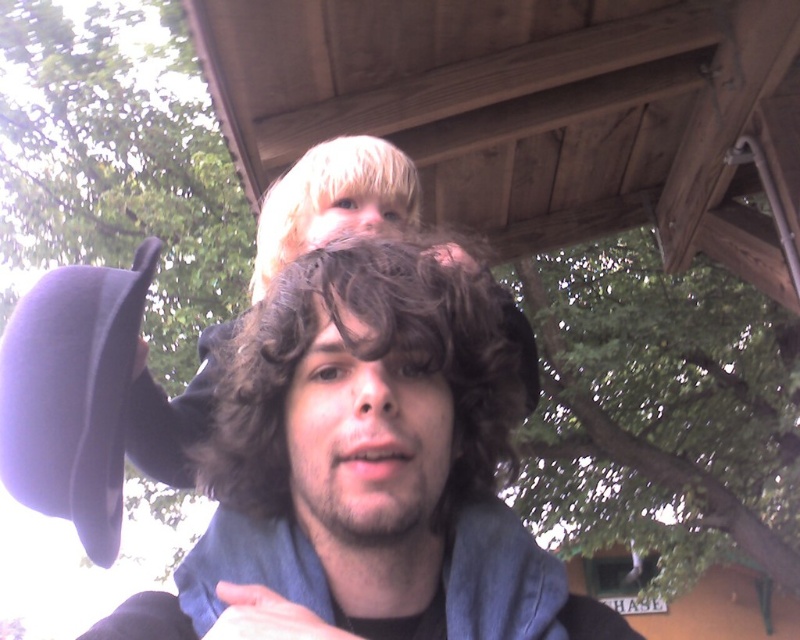
In the scene shown: Is matte purple hat at left positioned at the back of blondehair texture at upper center?

No, matte purple hat at left is in front of blondehair texture at upper center.

From the picture: Does matte purple hat at left appear over blondehair texture at upper center?

Actually, matte purple hat at left is below blondehair texture at upper center.

Who is more distant from viewer, (x=38, y=436) or (x=360, y=209)?

The point (x=360, y=209) is behind.

Where is `matte purple hat at left`? The width and height of the screenshot is (800, 640). matte purple hat at left is located at coordinates (72, 394).

How much distance is there between curly brown hair at center and matte purple hat at left?

curly brown hair at center is 9.54 inches away from matte purple hat at left.

The image size is (800, 640). I want to click on curly brown hair at center, so click(372, 360).

At what (x,y) coordinates should I click in order to perform the action: click on curly brown hair at center. Please return your answer as a coordinate pair (x, y). The width and height of the screenshot is (800, 640). Looking at the image, I should click on (372, 360).

Who is higher up, curly brown hair at center or blondehair texture at upper center?

blondehair texture at upper center is higher up.

Which is in front, point (264, 436) or point (396, 220)?

Point (264, 436)

Locate an element on the screen. Image resolution: width=800 pixels, height=640 pixels. curly brown hair at center is located at coordinates (372, 360).